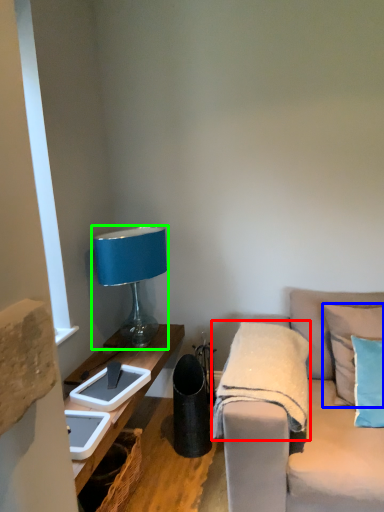
Question: Considering the real-world distances, which object is farthest from blanket (highlighted by a red box)? pillow (highlighted by a blue box) or lamp (highlighted by a green box)?

Choices:
 (A) pillow
 (B) lamp

Answer: (B)